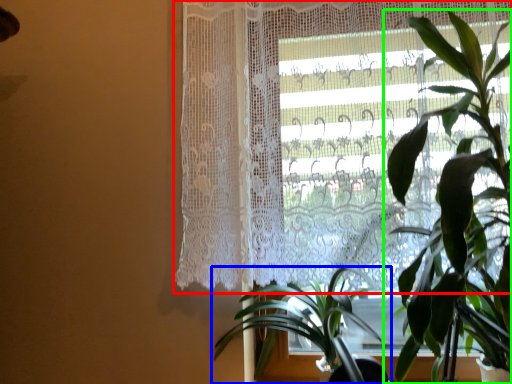
Question: Estimate the real-world distances between objects in this image. Which object is farther from curtain (highlighted by a red box), houseplant (highlighted by a blue box) or houseplant (highlighted by a green box)?

Choices:
 (A) houseplant
 (B) houseplant

Answer: (A)